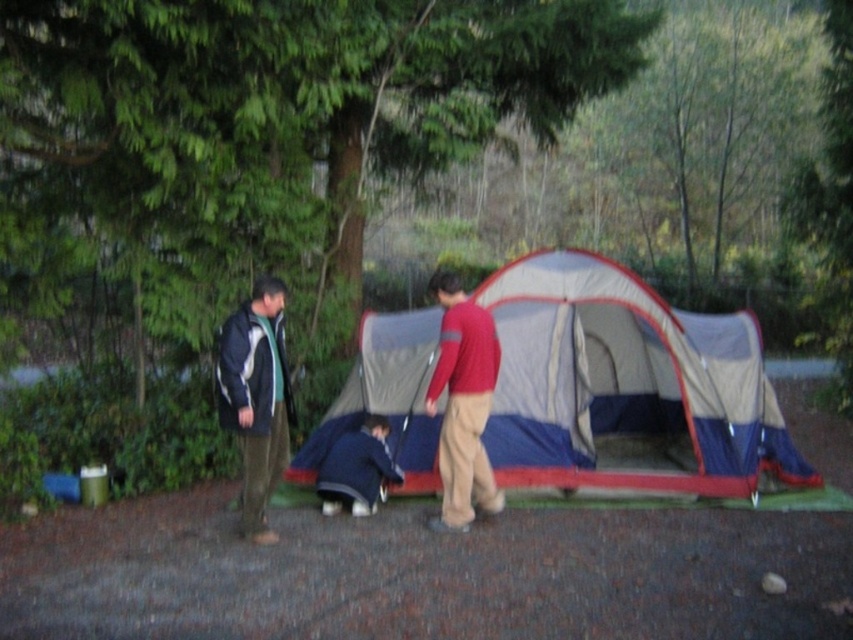
Question: Can you confirm if blue fabric tent at center is wider than red cotton shirt at center?

Choices:
 (A) no
 (B) yes

Answer: (B)

Question: Which point is farther from the camera taking this photo?

Choices:
 (A) pyautogui.click(x=469, y=372)
 (B) pyautogui.click(x=722, y=496)

Answer: (B)

Question: Estimate the real-world distances between objects in this image. Which object is farther from the dark blue fabric at lower center?

Choices:
 (A) blue jacket at left
 (B) green leafy tree at upper center
 (C) red cotton shirt at center
 (D) blue fabric tent at center

Answer: (B)

Question: Does blue jacket at left appear over red cotton shirt at center?

Choices:
 (A) no
 (B) yes

Answer: (A)

Question: Does blue jacket at left have a lesser width compared to dark blue fabric at lower center?

Choices:
 (A) yes
 (B) no

Answer: (A)

Question: Among these objects, which one is nearest to the camera?

Choices:
 (A) blue jacket at left
 (B) dark blue fabric at lower center
 (C) red cotton shirt at center
 (D) blue fabric tent at center

Answer: (A)